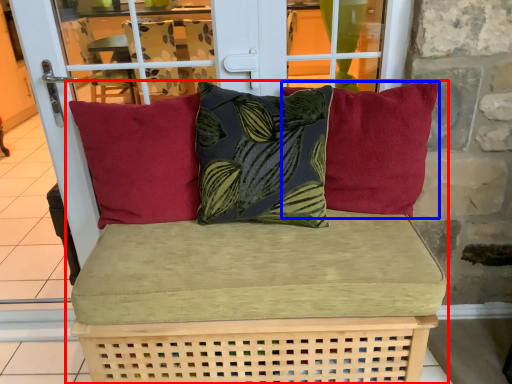
Question: Which object appears closest to the camera in this image, studio couch (highlighted by a red box) or pillow (highlighted by a blue box)?

Choices:
 (A) studio couch
 (B) pillow

Answer: (A)